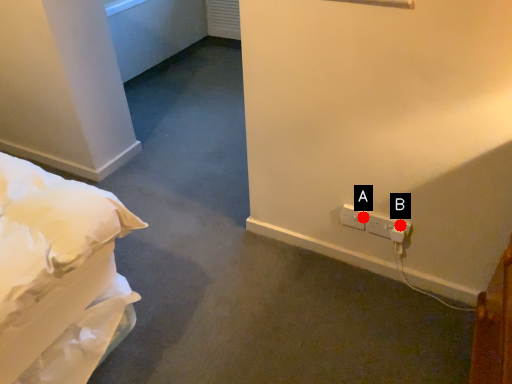
Question: Two points are circled on the image, labeled by A and B beside each circle. Which point is further to the camera?

Choices:
 (A) A is further
 (B) B is further

Answer: (A)